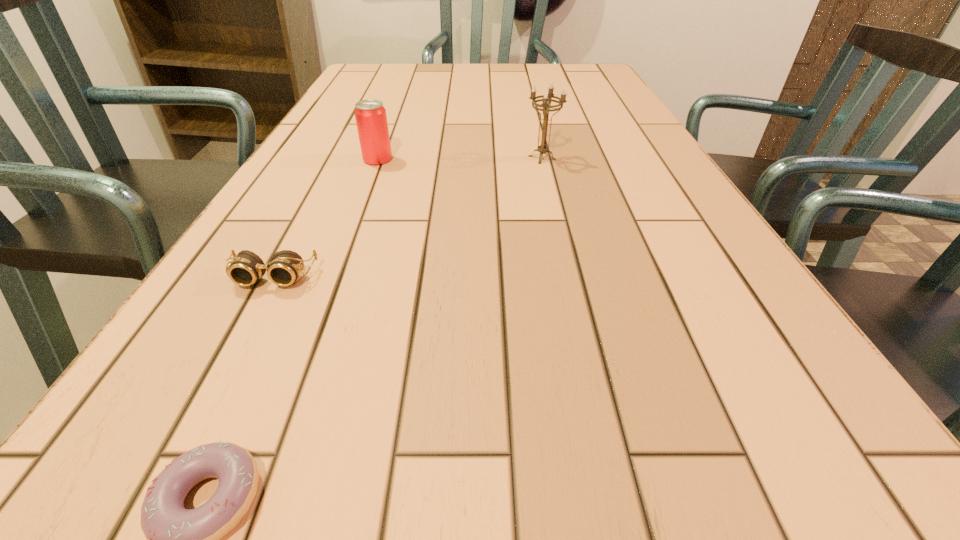
Locate an element on the screen. The width and height of the screenshot is (960, 540). object that stands as the third closest to the tallest object is located at coordinates (177, 539).